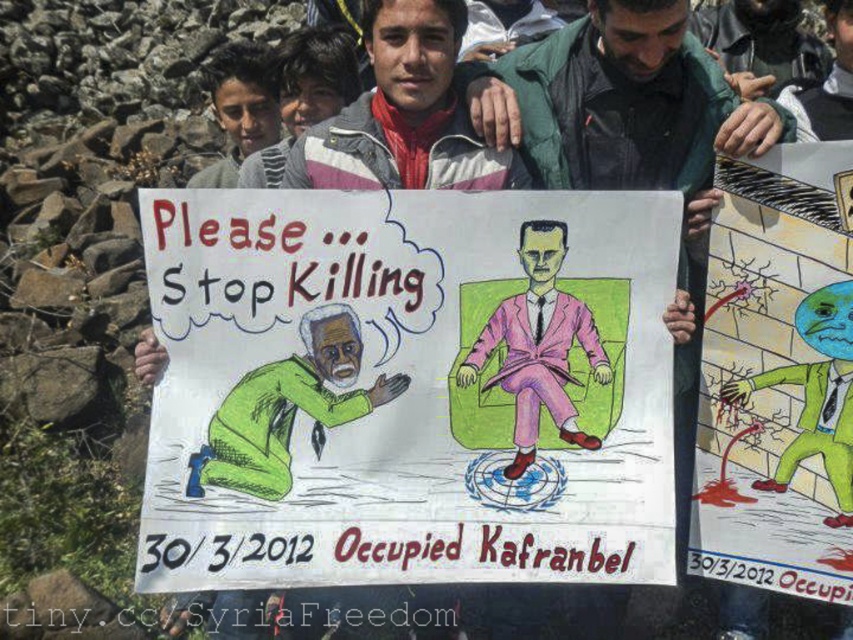
In the protest scene, there are two green items visible in the image. The first is a green rubber glove at lower right and the second is a green fabric shirt at center. Which of these two items is located more to the left in the image?

The green rubber glove at lower right is positioned on the left side of green fabric shirt at center, so the green rubber glove at lower right is more to the left.